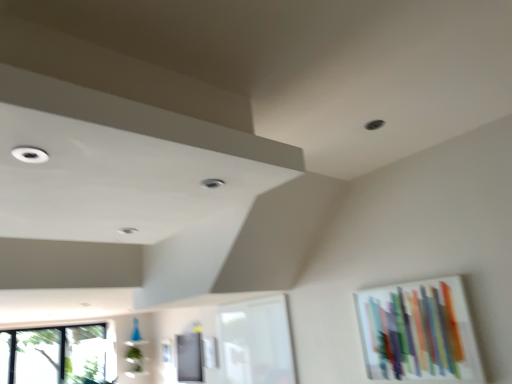
Question: From a real-world perspective, is translucent glass artwork at upper right above or below white glass window frame at center?

Choices:
 (A) below
 (B) above

Answer: (A)

Question: From their relative heights in the image, would you say translucent glass artwork at upper right is taller or shorter than white glass window frame at center?

Choices:
 (A) tall
 (B) short

Answer: (B)

Question: Which object is positioned closest to the white glass window frame at center?

Choices:
 (A) translucent glass artwork at upper right
 (B) transparent glass window at lower left

Answer: (A)

Question: Which is nearer to the translucent glass artwork at upper right?

Choices:
 (A) white glass window frame at center
 (B) transparent glass window at lower left

Answer: (A)